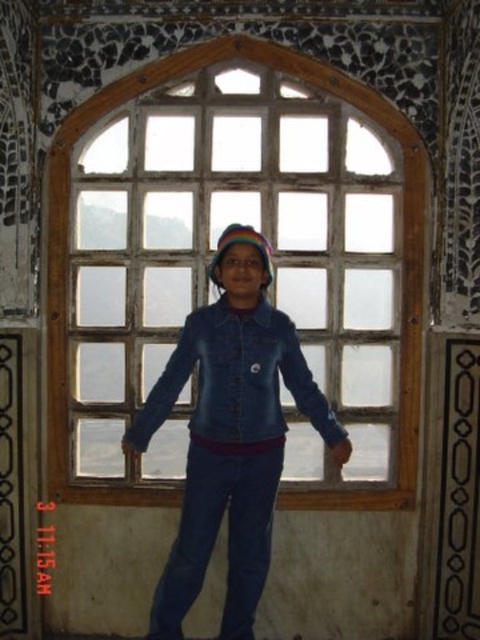
You are standing in the room with the arched window and see two points marked on the wall. The first point is at coordinates point (x=405, y=493) and the second is at point (x=294, y=378). Which point is closer to you?

Point (x=405, y=493) is further to the viewer than point (x=294, y=378), so the second point is closer to you.